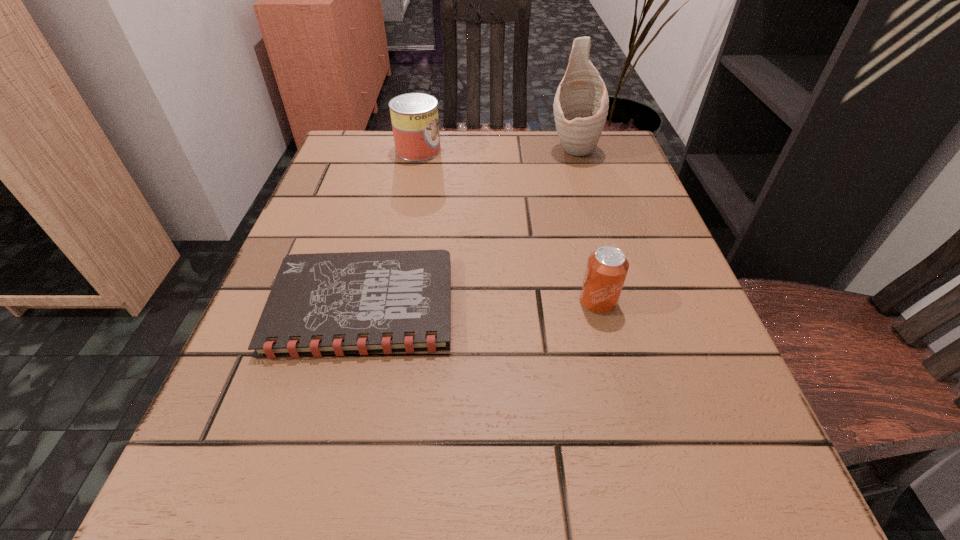
In the image, there is a desktop. What are the coordinates of `vacant space at the right edge` in the screenshot? It's located at (644, 246).

This screenshot has height=540, width=960. In order to click on vacant region at the far left corner of the desktop in this screenshot , I will do `click(336, 172)`.

This screenshot has width=960, height=540. In order to click on vacant space at the far right corner of the desktop in this screenshot , I will do `click(566, 155)`.

Where is `vacant space that is in between the notebook and the pitcher`? This screenshot has width=960, height=540. vacant space that is in between the notebook and the pitcher is located at coordinates (468, 227).

The width and height of the screenshot is (960, 540). I want to click on free space between the pitcher and the notebook, so coord(468,227).

The image size is (960, 540). I want to click on blank region between the notebook and the second shortest object, so click(480, 303).

Where is `free area in between the farther can and the pitcher`? free area in between the farther can and the pitcher is located at coordinates (x=495, y=150).

What are the coordinates of `free spot between the farther can and the shortest object` in the screenshot? It's located at (391, 227).

Find the location of a particular element. The width and height of the screenshot is (960, 540). vacant point located between the right can and the pitcher is located at coordinates (586, 225).

Where is `free space between the farther can and the shortest object`? Image resolution: width=960 pixels, height=540 pixels. free space between the farther can and the shortest object is located at coordinates (391, 227).